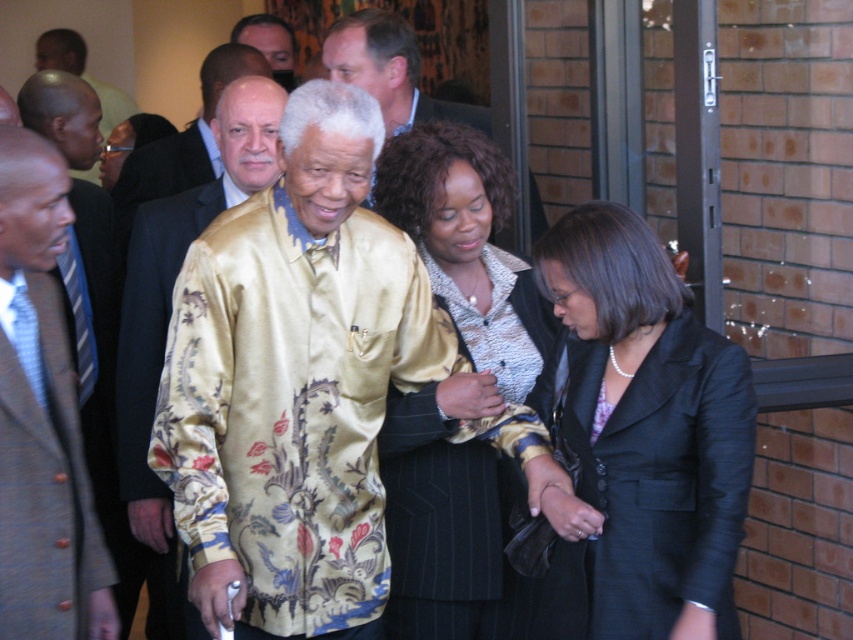
Does silky yellow shirt at center have a greater height compared to gold satin robe at center?

No, silky yellow shirt at center is not taller than gold satin robe at center.

Locate an element on the screen. The width and height of the screenshot is (853, 640). silky yellow shirt at center is located at coordinates (293, 385).

Is point (178, 147) farther from camera compared to point (242, 36)?

No, (178, 147) is in front of (242, 36).

In the scene shown: Does gold silk robe at center have a larger size compared to smooth black suit at center?

Correct, gold silk robe at center is larger in size than smooth black suit at center.

At what (x,y) coordinates should I click in order to perform the action: click on gold silk robe at center. Please return your answer as a coordinate pair (x, y). This screenshot has width=853, height=640. Looking at the image, I should click on (183, 141).

Based on the photo, does brown wool suit at left have a greater width compared to smooth black suit at center?

No.

Describe the element at coordinates (42, 417) in the screenshot. Image resolution: width=853 pixels, height=640 pixels. I see `brown wool suit at left` at that location.

This screenshot has width=853, height=640. Describe the element at coordinates (42, 417) in the screenshot. I see `brown wool suit at left` at that location.

Identify the location of brown wool suit at left. This screenshot has width=853, height=640. (42, 417).